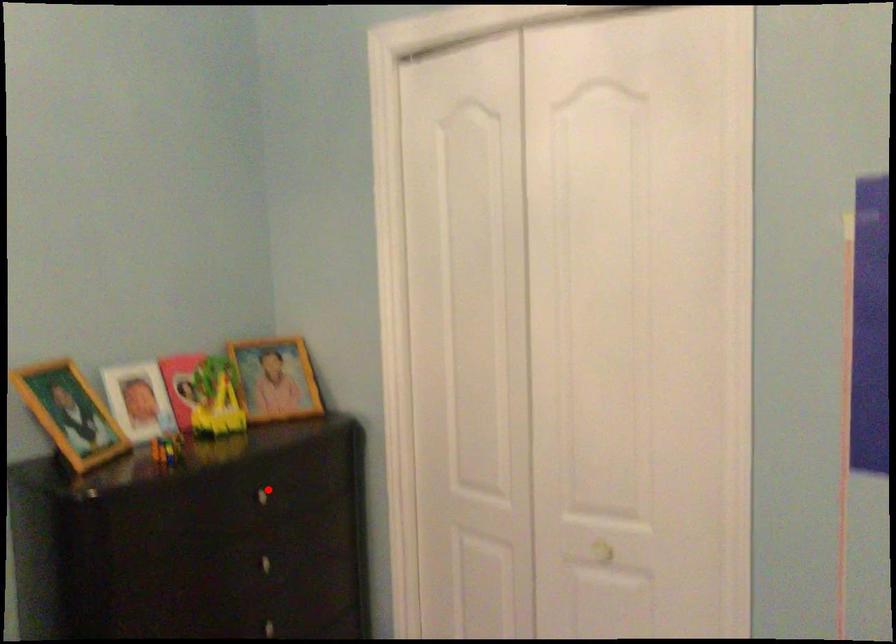
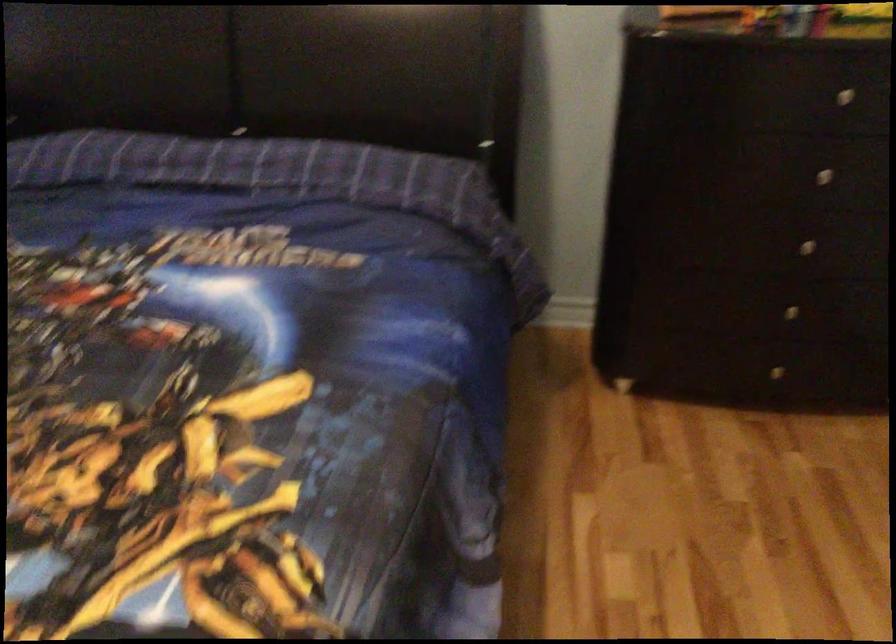
The point at the highlighted location is marked in the first image. Where is the corresponding point in the second image?

(858, 91)